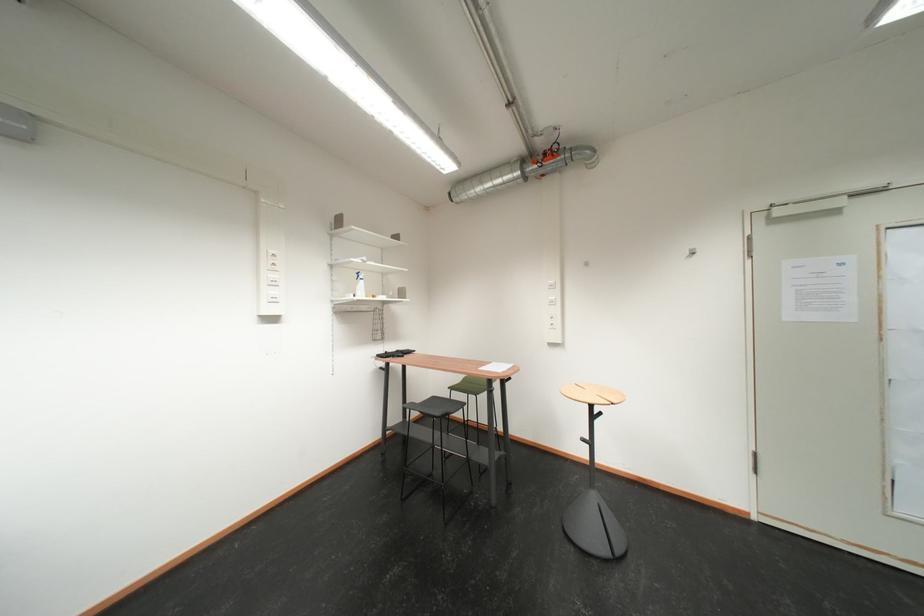
Find where to lift the spray bottle. Please return your answer as a coordinate pair (x, y).

(359, 285)